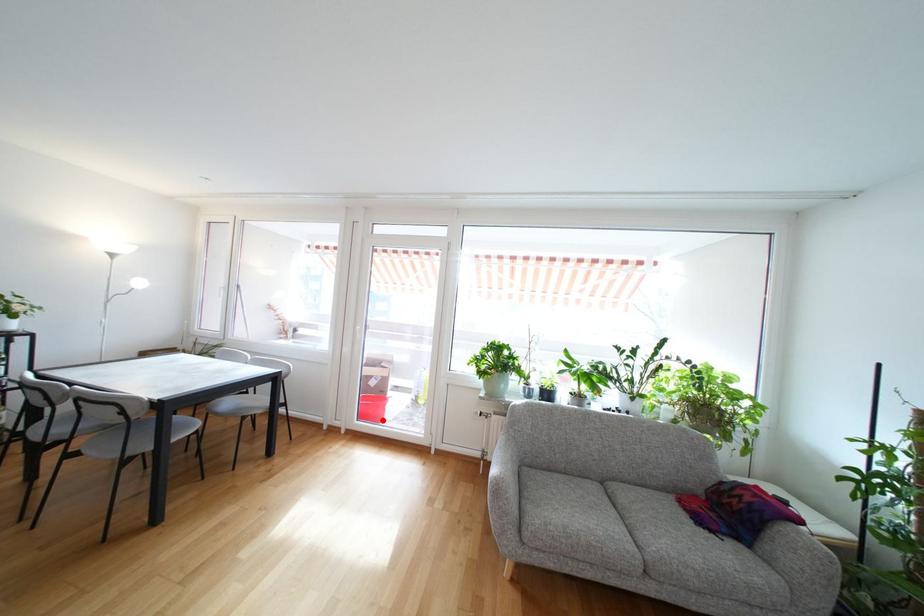
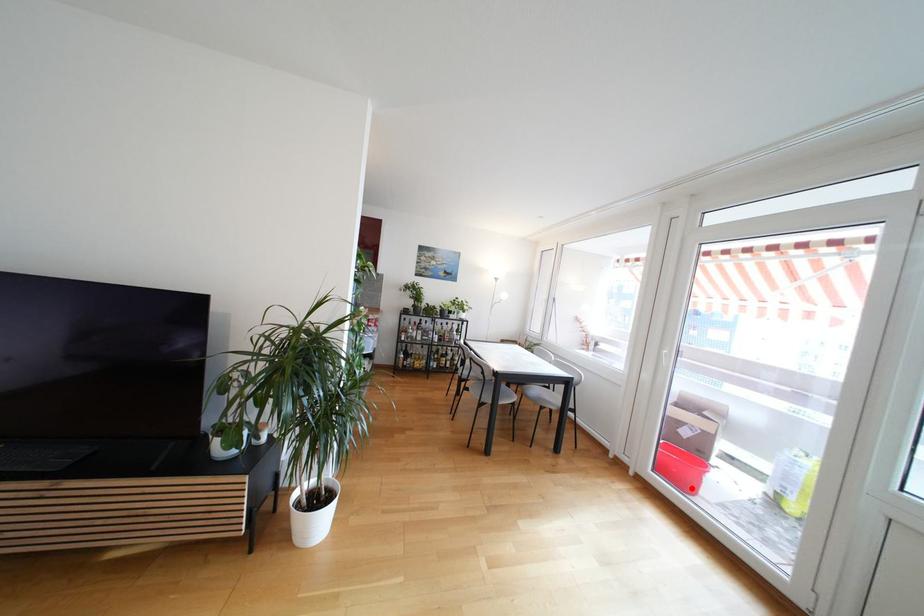
I am providing you with two images of the same scene from different viewpoints. A red point is marked on the first image and another point is marked on the second image. Are the points marked in image1 and image2 representing the same 3D position?

Yes